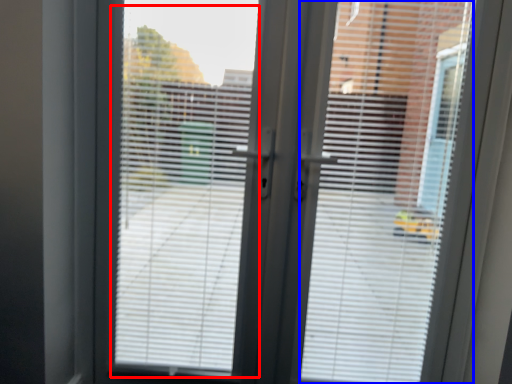
Question: Among these objects, which one is farthest to the camera, window screen (highlighted by a red box) or blind (highlighted by a blue box)?

Choices:
 (A) window screen
 (B) blind

Answer: (A)